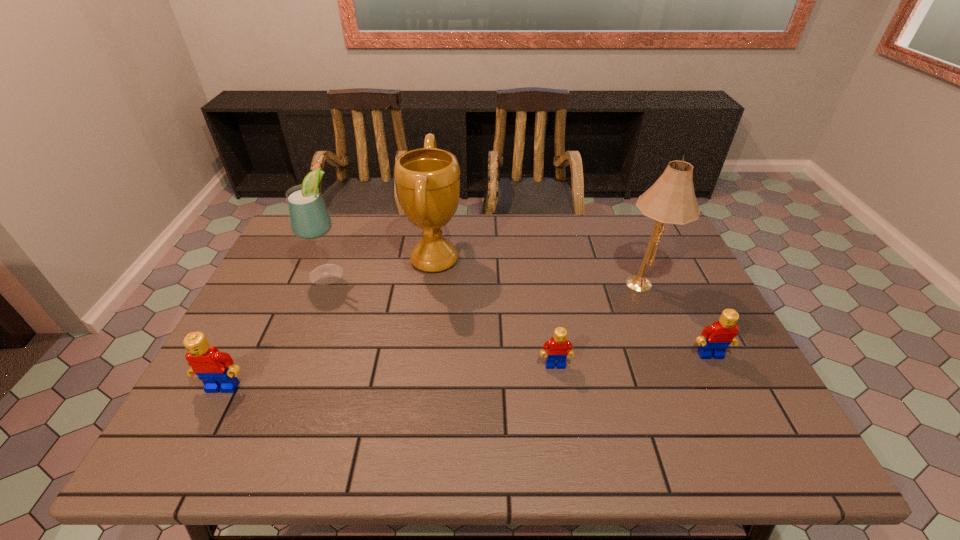
Locate an element on the screen. The width and height of the screenshot is (960, 540). free space between the award and the fifth tallest object is located at coordinates (572, 307).

Locate an element on the screen. The image size is (960, 540). unoccupied position between the second shortest Lego and the nearest object is located at coordinates (467, 371).

Where is `free space that is in between the rightmost Lego and the award`? Image resolution: width=960 pixels, height=540 pixels. free space that is in between the rightmost Lego and the award is located at coordinates [x=572, y=307].

Where is `vacant point located between the alcohol and the third object from left to right`? vacant point located between the alcohol and the third object from left to right is located at coordinates (381, 266).

The image size is (960, 540). Identify the location of vacant region between the second object from left to right and the lampshade. (486, 278).

Where is `empty location between the lampshade and the nearest Lego`? This screenshot has width=960, height=540. empty location between the lampshade and the nearest Lego is located at coordinates (434, 335).

Where is `unoccupied position between the lampshade and the second Lego from right to left`? unoccupied position between the lampshade and the second Lego from right to left is located at coordinates (600, 324).

Choose which object is the fourth nearest neighbor to the shortest Lego. Please provide its 2D coordinates. Your answer should be formatted as a tuple, i.e. [(x, y)], where the tuple contains the x and y coordinates of a point satisfying the conditions above.

[(309, 218)]

Locate which object is the second closest to the fifth tallest object. Please provide its 2D coordinates. Your answer should be formatted as a tuple, i.e. [(x, y)], where the tuple contains the x and y coordinates of a point satisfying the conditions above.

[(556, 349)]

Locate an element on the screen. Image resolution: width=960 pixels, height=540 pixels. Lego that is the third closest one to the alcohol is located at coordinates (720, 334).